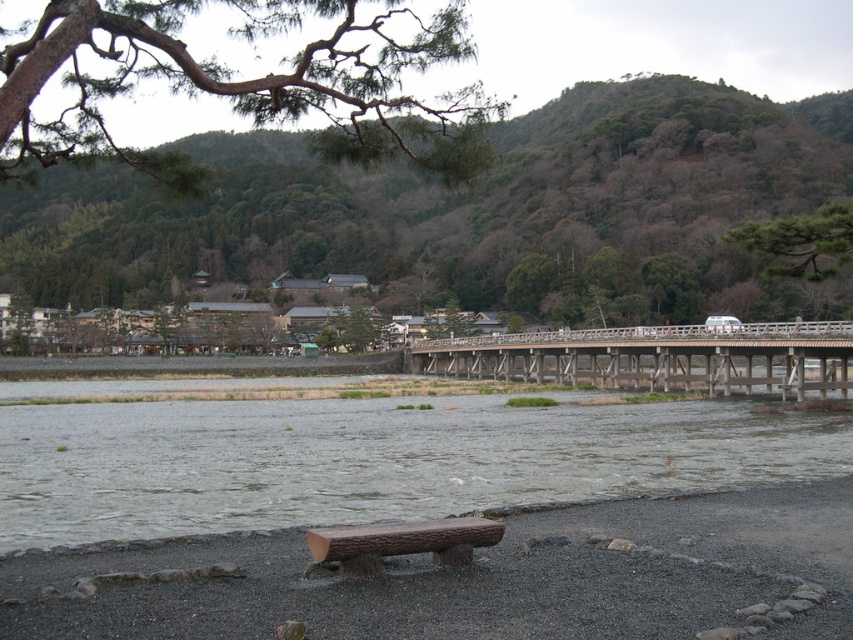
Does green leafy hillside at upper center appear under wooden bridge at center?

Actually, green leafy hillside at upper center is above wooden bridge at center.

Is point (264, 227) farther from viewer compared to point (590, 374)?

That is True.

Locate an element on the screen. This screenshot has height=640, width=853. green leafy hillside at upper center is located at coordinates (450, 202).

Is gray concrete river at lower center thinner than wooden bridge at center?

In fact, gray concrete river at lower center might be wider than wooden bridge at center.

Can you confirm if gray concrete river at lower center is positioned below wooden bridge at center?

Indeed, gray concrete river at lower center is positioned under wooden bridge at center.

This screenshot has height=640, width=853. Describe the element at coordinates (372, 460) in the screenshot. I see `gray concrete river at lower center` at that location.

The height and width of the screenshot is (640, 853). What are the coordinates of `gray concrete river at lower center` in the screenshot? It's located at (372, 460).

Find the location of a particular element. The image size is (853, 640). green leafy hillside at upper center is located at coordinates (450, 202).

The width and height of the screenshot is (853, 640). I want to click on green leafy hillside at upper center, so click(x=450, y=202).